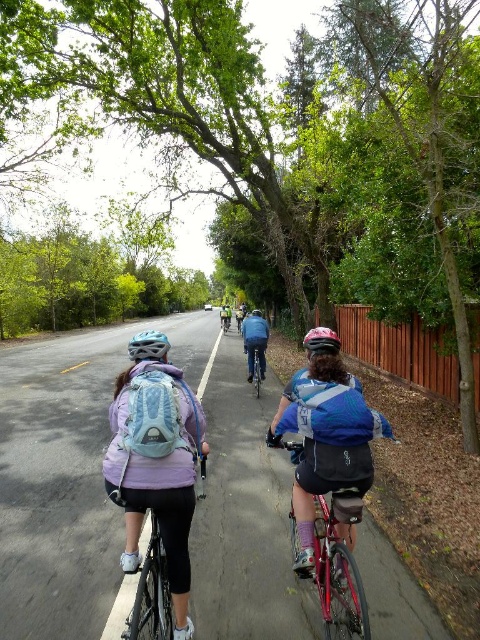
You are standing at the starting line of the cycling path and see two points marked on the path ahead. The first point is at coordinates point (342, 600) and the second point is at point (253, 368). Which point is closer to you?

Point (342, 600) is closer to the viewer than point (253, 368), so the first point is closer to you.

You are a photographer standing behind the cyclists. You want to take a photo of the blue denim jacket at center without the matte blue backpack at left blocking it. What should you do?

Move to the right side so the blue denim jacket at center is no longer behind the matte blue backpack at left.

You are a photographer standing behind the cyclists and want to capture both the shiny red bicycle at center and the matte black helmet at center in your shot. Which object should you focus on first if you want to ensure both are in focus, considering their sizes?

The shiny red bicycle at center is taller than the matte black helmet at center, so you should focus on the shiny red bicycle at center first to ensure both are in focus.